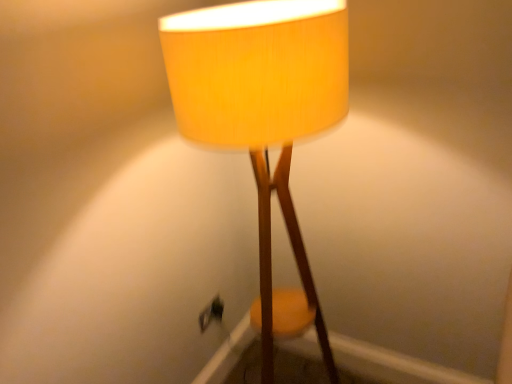
This screenshot has width=512, height=384. I want to click on matte yellow fabric lampshade at center, so click(263, 118).

What do you see at coordinates (263, 118) in the screenshot? Image resolution: width=512 pixels, height=384 pixels. I see `matte yellow fabric lampshade at center` at bounding box center [263, 118].

The height and width of the screenshot is (384, 512). What are the coordinates of `matte yellow fabric lampshade at center` in the screenshot? It's located at (263, 118).